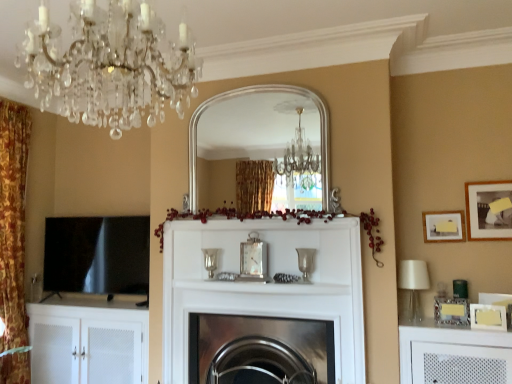
Question: Does metallic silver picture frame at right, which is counted as the 1th picture frame, starting from the bottom, have a larger size compared to crystal glass chandelier at upper left?

Choices:
 (A) no
 (B) yes

Answer: (A)

Question: Would you say crystal glass chandelier at upper left is part of metallic silver picture frame at right, which is counted as the 1th picture frame, starting from the bottom,'s contents?

Choices:
 (A) yes
 (B) no

Answer: (B)

Question: Does metallic silver picture frame at right, which is counted as the 1th picture frame, starting from the bottom, touch crystal glass chandelier at upper left?

Choices:
 (A) yes
 (B) no

Answer: (B)

Question: Considering the relative sizes of metallic silver picture frame at right, the 4th picture frame in the top-to-bottom sequence, and crystal glass chandelier at upper left in the image provided, is metallic silver picture frame at right, the 4th picture frame in the top-to-bottom sequence, taller than crystal glass chandelier at upper left?

Choices:
 (A) yes
 (B) no

Answer: (B)

Question: From a real-world perspective, is metallic silver picture frame at right, the 4th picture frame in the top-to-bottom sequence, below crystal glass chandelier at upper left?

Choices:
 (A) yes
 (B) no

Answer: (A)

Question: From the image's perspective, is metallic silver picture frame at right, the 4th picture frame in the top-to-bottom sequence, over crystal glass chandelier at upper left?

Choices:
 (A) no
 (B) yes

Answer: (A)

Question: From a real-world perspective, is crystal glass chandelier at upper left located beneath matte white picture frame at upper right, marked as the third picture frame in a bottom-to-top arrangement?

Choices:
 (A) no
 (B) yes

Answer: (A)

Question: Does crystal glass chandelier at upper left have a greater height compared to matte white picture frame at upper right, marked as the third picture frame in a bottom-to-top arrangement?

Choices:
 (A) no
 (B) yes

Answer: (B)

Question: Is crystal glass chandelier at upper left positioned beyond the bounds of matte white picture frame at upper right, the 2th picture frame viewed from the top?

Choices:
 (A) no
 (B) yes

Answer: (B)

Question: Is crystal glass chandelier at upper left beside matte white picture frame at upper right, marked as the third picture frame in a bottom-to-top arrangement?

Choices:
 (A) no
 (B) yes

Answer: (A)

Question: Could you tell me if crystal glass chandelier at upper left is turned towards matte white picture frame at upper right, marked as the third picture frame in a bottom-to-top arrangement?

Choices:
 (A) no
 (B) yes

Answer: (A)

Question: Does crystal glass chandelier at upper left have a larger size compared to matte white picture frame at upper right, marked as the third picture frame in a bottom-to-top arrangement?

Choices:
 (A) no
 (B) yes

Answer: (B)

Question: Does silver/metallic mirror at center appear on the right side of crystal glass chandelier at upper left?

Choices:
 (A) no
 (B) yes

Answer: (B)